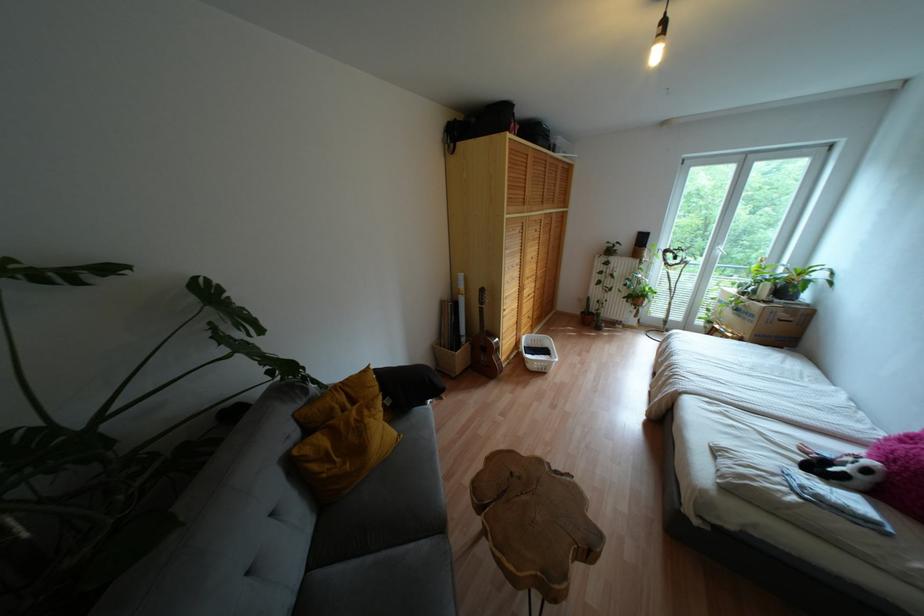
Find the location of a particular element. The width and height of the screenshot is (924, 616). sofa sitting surface is located at coordinates (393, 582).